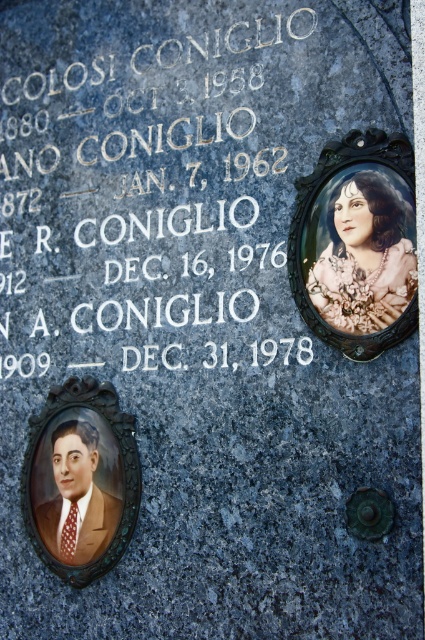
Question: Which of the following is the farthest from the observer?

Choices:
 (A) (144, 349)
 (B) (116, 481)

Answer: (A)

Question: Which of the following is the farthest from the observer?

Choices:
 (A) white granite stone at center
 (B) matte brown suit at lower left
 (C) pastel floral dress at upper right

Answer: (B)

Question: Does white granite stone at center have a lesser width compared to pastel floral dress at upper right?

Choices:
 (A) no
 (B) yes

Answer: (A)

Question: Which point is farther to the camera?

Choices:
 (A) (367, 237)
 (B) (232, 323)
 (C) (47, 465)

Answer: (C)

Question: Does white granite stone at center appear under pastel floral dress at upper right?

Choices:
 (A) yes
 (B) no

Answer: (B)

Question: Is pastel floral dress at upper right wider than matte brown suit at lower left?

Choices:
 (A) no
 (B) yes

Answer: (A)